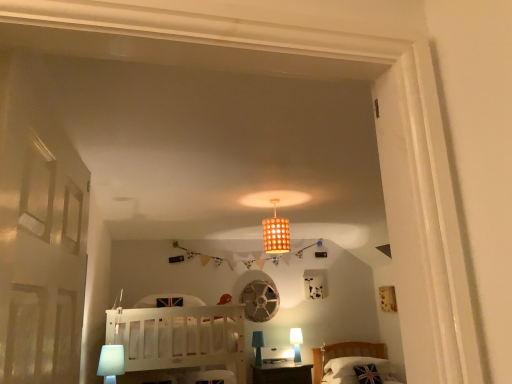
What are the coordinates of `free spot above wooden lampshade at center (from a real-world perspective)` in the screenshot? It's located at (269, 201).